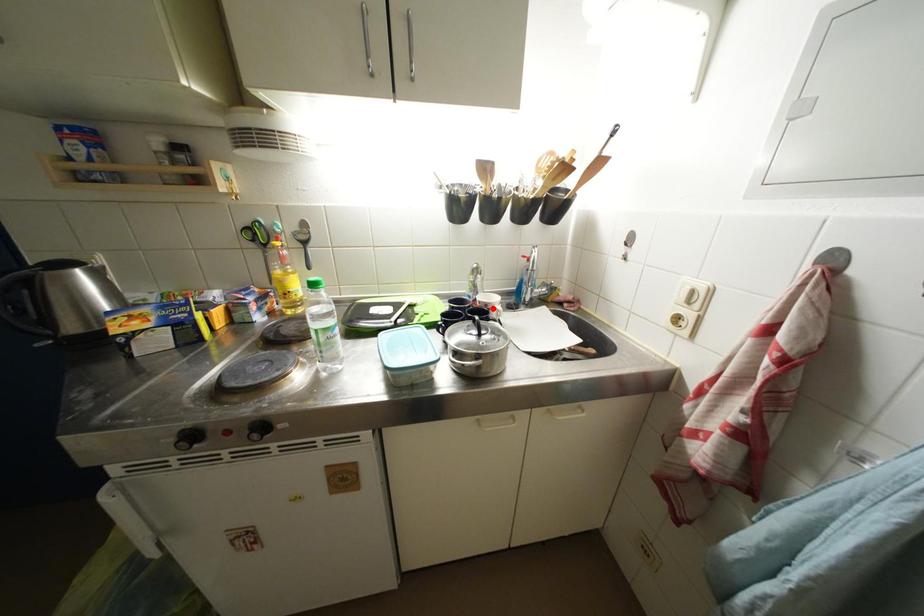
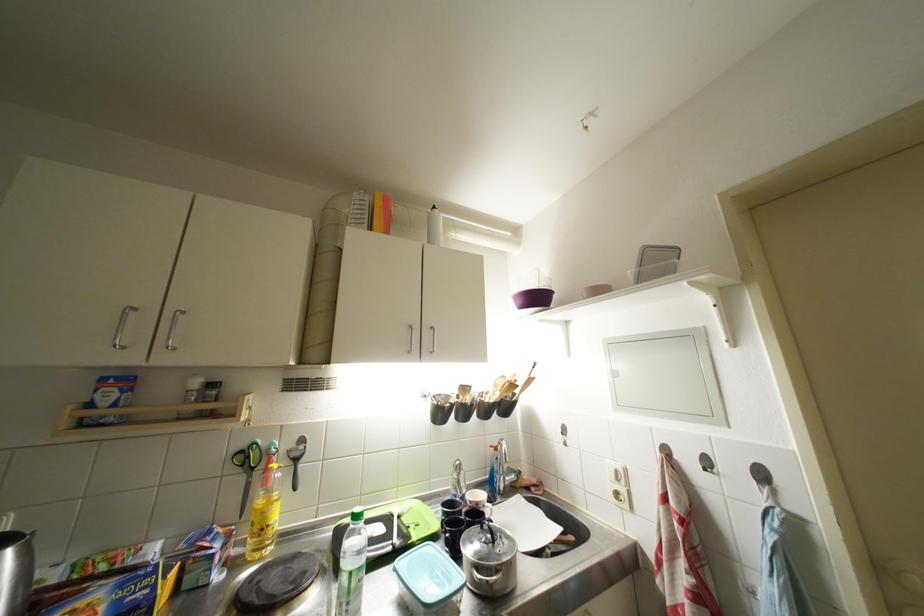
Locate, in the second image, the point that corresponds to the highlighted location in the first image.

(483, 508)